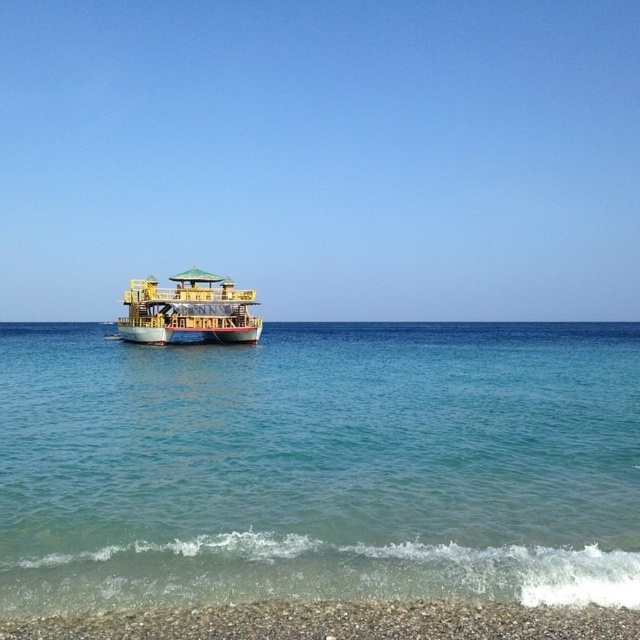
You are standing on the shore looking out at the clear blue water at center and the yellow wooden boat at center. Which one appears wider from your perspective?

The clear blue water at center appears wider than the yellow wooden boat at center because its width surpasses that of the boat.

You are standing on the shore looking out at the scene. Which object, the clear blue water at center or the yellow wooden boat at center, is closer to you?

The clear blue water at center is closer to you because it is in front of the yellow wooden boat at center.